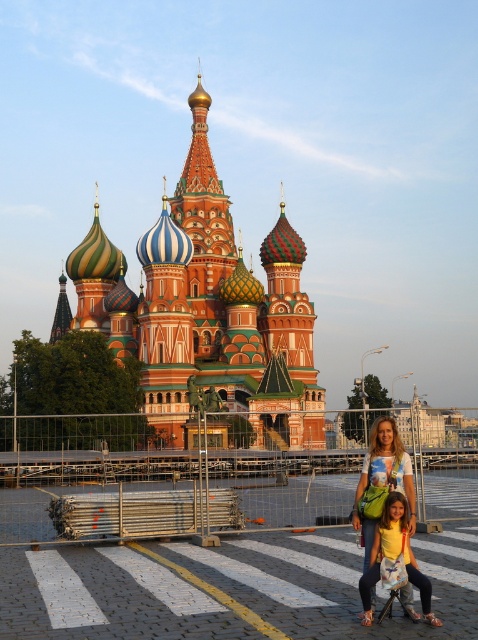
Question: Which point appears closest to the camera in this image?

Choices:
 (A) (147, 348)
 (B) (399, 528)

Answer: (B)

Question: Which object is positioned farthest from the yellow matte shirt at lower center?

Choices:
 (A) multicolored mosaic church at center
 (B) matte white t-shirt at center

Answer: (A)

Question: Which point appears closest to the camera in this image?

Choices:
 (A) tap(434, 625)
 (B) tap(300, 410)

Answer: (A)

Question: Does multicolored mosaic church at center come in front of matte white t-shirt at center?

Choices:
 (A) no
 (B) yes

Answer: (A)

Question: Does multicolored mosaic church at center have a lesser width compared to matte white t-shirt at center?

Choices:
 (A) yes
 (B) no

Answer: (B)

Question: Is the position of matte white t-shirt at center more distant than that of yellow matte shirt at lower center?

Choices:
 (A) no
 (B) yes

Answer: (B)